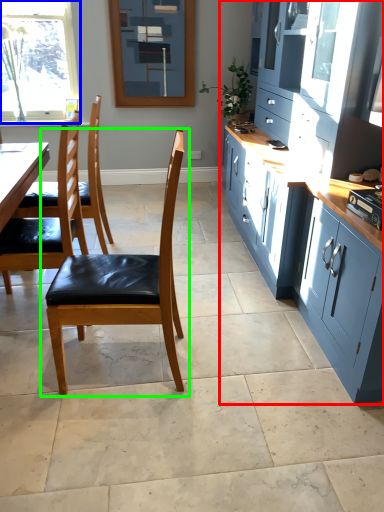
Question: Which is farther away from cabinetry (highlighted by a red box)? window (highlighted by a blue box) or chair (highlighted by a green box)?

Choices:
 (A) window
 (B) chair

Answer: (A)